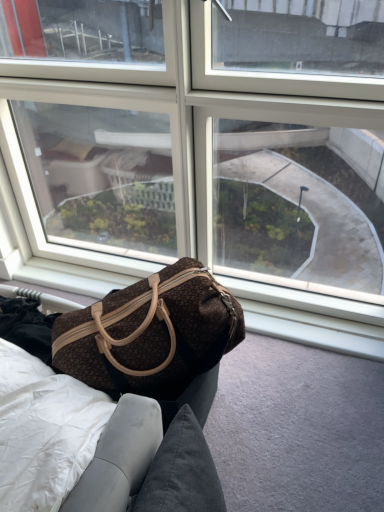
The width and height of the screenshot is (384, 512). What do you see at coordinates (150, 334) in the screenshot? I see `brown textured fabric bag at center` at bounding box center [150, 334].

What is the approximate height of brown textured fabric bag at center?

It is 12.04 inches.

The width and height of the screenshot is (384, 512). What do you see at coordinates (155, 457) in the screenshot?
I see `brown fabric bag at lower left` at bounding box center [155, 457].

Locate an element on the screen. Image resolution: width=384 pixels, height=512 pixels. brown fabric bag at lower left is located at coordinates (155, 457).

You are a GUI agent. You are given a task and a screenshot of the screen. Output one action in this format:
    pyautogui.click(x=<x>, y=<y>)
    Task: Click on the transparent glass window at center
    
    Given the screenshot: What is the action you would take?
    pyautogui.click(x=201, y=162)

Consider the image. Is brown fabric bag at lower left wider than brown textured fabric bag at center?

Yes, brown fabric bag at lower left is wider than brown textured fabric bag at center.

Is brown fabric bag at lower left far from brown textured fabric bag at center?

No, there isn't a large distance between brown fabric bag at lower left and brown textured fabric bag at center.

Is brown fabric bag at lower left taller than brown textured fabric bag at center?

No.

How many degrees apart are the facing directions of brown fabric bag at lower left and brown textured fabric bag at center?

There is a 90-degree angle between the facing directions of brown fabric bag at lower left and brown textured fabric bag at center.

From the image's perspective, is transparent glass window at center located beneath brown textured fabric bag at center?

No, from the image's perspective, transparent glass window at center is not below brown textured fabric bag at center.

Considering the positions of objects transparent glass window at center and brown textured fabric bag at center in the image provided, who is behind, transparent glass window at center or brown textured fabric bag at center?

transparent glass window at center is further from the camera.

Considering the relative sizes of transparent glass window at center and brown textured fabric bag at center in the image provided, is transparent glass window at center wider than brown textured fabric bag at center?

No.

Is brown textured fabric bag at center a part of transparent glass window at center?

No, brown textured fabric bag at center is not a part of transparent glass window at center.

From a real-world perspective, is transparent glass window at center physically below brown fabric bag at lower left?

Actually, transparent glass window at center is physically above brown fabric bag at lower left in the real world.

Which object is further away from the camera taking this photo, transparent glass window at center or brown fabric bag at lower left?

transparent glass window at center.

Is transparent glass window at center located outside brown fabric bag at lower left?

Yes, transparent glass window at center is located beyond the bounds of brown fabric bag at lower left.

Does point (346, 114) lie behind point (157, 446)?

Yes, it is behind point (157, 446).

In the scene shown: From the image's perspective, is brown textured fabric bag at center over brown fabric bag at lower left?

Indeed, from the image's perspective, brown textured fabric bag at center is shown above brown fabric bag at lower left.

Is brown textured fabric bag at center in contact with brown fabric bag at lower left?

No, brown textured fabric bag at center is not in contact with brown fabric bag at lower left.

Considering the sizes of objects brown textured fabric bag at center and brown fabric bag at lower left in the image provided, who is taller, brown textured fabric bag at center or brown fabric bag at lower left?

Standing taller between the two is brown textured fabric bag at center.

Is point (144, 462) closer or farther from the camera than point (222, 144)?

Point (144, 462) is positioned closer to the camera compared to point (222, 144).

Which is behind, brown fabric bag at lower left or transparent glass window at center?

transparent glass window at center is more distant.

Can you tell me how much brown fabric bag at lower left and transparent glass window at center differ in facing direction?

brown fabric bag at lower left and transparent glass window at center are facing 90 degrees away from each other.

Is transparent glass window at center a part of brown fabric bag at lower left?

No, brown fabric bag at lower left does not contain transparent glass window at center.

Who is more distant, brown textured fabric bag at center or transparent glass window at center?

transparent glass window at center is further away from the camera.

What's the angular difference between brown textured fabric bag at center and transparent glass window at center's facing directions?

0.000287 degrees.

In terms of height, does brown textured fabric bag at center look taller or shorter compared to transparent glass window at center?

Considering their sizes, brown textured fabric bag at center has less height than transparent glass window at center.

Find the location of a particular element. furniture below the brown textured fabric bag at center (from the image's perspective) is located at coordinates (155, 457).

This screenshot has height=512, width=384. In order to click on handbag in front of the transparent glass window at center in this screenshot , I will do `click(150, 334)`.

Which object lies further to the anchor point brown textured fabric bag at center, transparent glass window at center or brown fabric bag at lower left?

Among the two, transparent glass window at center is located further to brown textured fabric bag at center.

When comparing their distances from brown fabric bag at lower left, does transparent glass window at center or brown textured fabric bag at center seem further?

transparent glass window at center is further to brown fabric bag at lower left.

Considering their positions, is brown fabric bag at lower left positioned further to transparent glass window at center than brown textured fabric bag at center?

Among the two, brown fabric bag at lower left is located further to transparent glass window at center.

Estimate the real-world distances between objects in this image. Which object is further from brown textured fabric bag at center, brown fabric bag at lower left or transparent glass window at center?

Among the two, transparent glass window at center is located further to brown textured fabric bag at center.

From the image, which object appears to be nearer to transparent glass window at center, brown textured fabric bag at center or brown fabric bag at lower left?

brown textured fabric bag at center is closer to transparent glass window at center.

Looking at the image, which one is located closer to brown fabric bag at lower left, brown textured fabric bag at center or transparent glass window at center?

Based on the image, brown textured fabric bag at center appears to be nearer to brown fabric bag at lower left.

This screenshot has height=512, width=384. What are the coordinates of `handbag between transparent glass window at center and brown fabric bag at lower left in the up-down direction` in the screenshot? It's located at (150, 334).